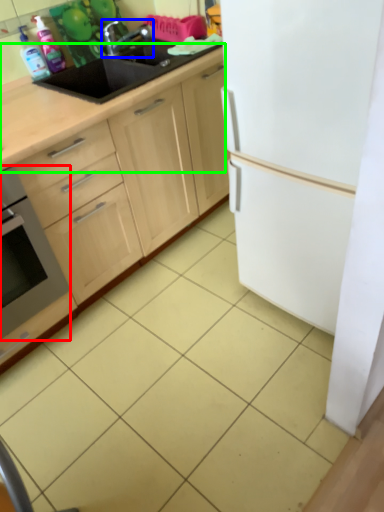
Question: Estimate the real-world distances between objects in this image. Which object is farther from home appliance (highlighted by a red box), tap (highlighted by a blue box) or countertop (highlighted by a green box)?

Choices:
 (A) tap
 (B) countertop

Answer: (A)